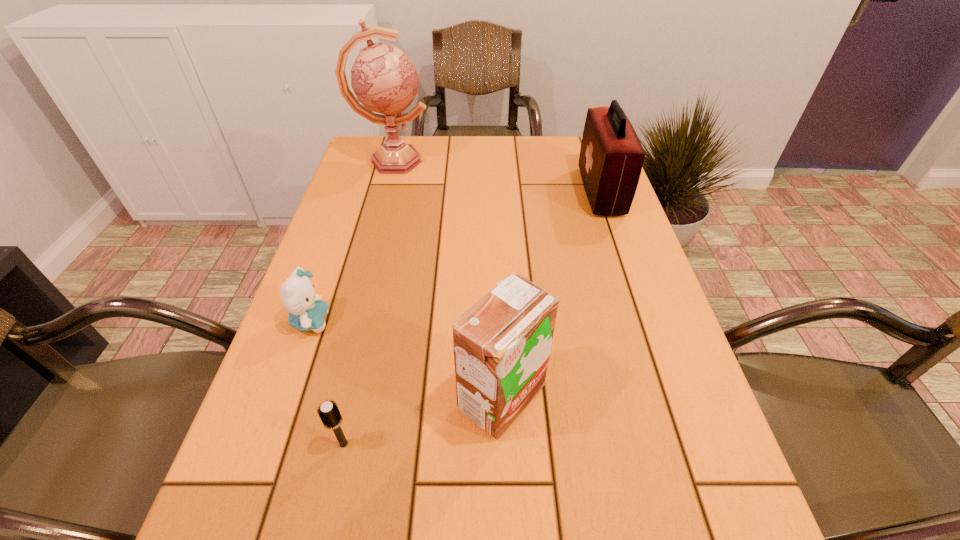
Locate an element on the screen. This screenshot has width=960, height=540. globe is located at coordinates (383, 78).

Find the location of `the first aid kit`. the first aid kit is located at coordinates (611, 157).

Locate an element on the screen. the second object from right to left is located at coordinates (502, 344).

Find the location of a particular element. The height and width of the screenshot is (540, 960). kitten is located at coordinates (307, 311).

Where is `hairbrush`? This screenshot has height=540, width=960. hairbrush is located at coordinates (329, 413).

Find the location of a particular element. vacant space situated 0.130m on the front-facing side of the globe is located at coordinates (472, 161).

Identify the location of vacant area located on the side of the rightmost object with the cross symbol. (451, 192).

This screenshot has width=960, height=540. What are the coordinates of `free point located on the side of the rightmost object with the cross symbol` in the screenshot? It's located at (448, 192).

Find the location of a particular element. The height and width of the screenshot is (540, 960). vacant space situated 0.290m on the side of the rightmost object with the cross symbol is located at coordinates (480, 192).

In order to click on free region located 0.250m on the straw side of the fourth object from left to right in this screenshot , I will do `click(319, 397)`.